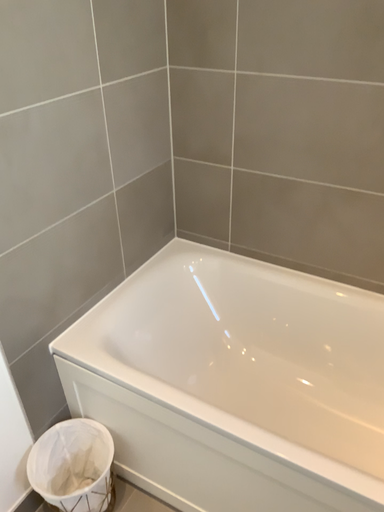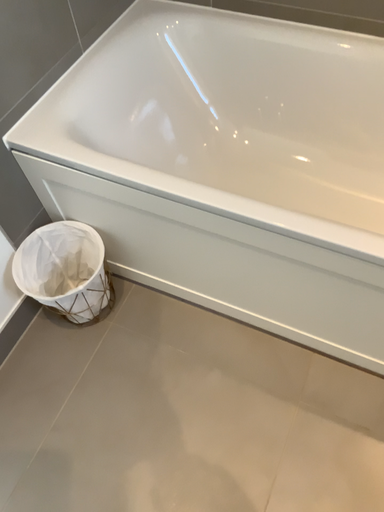
Question: How did the camera likely rotate when shooting the video?

Choices:
 (A) rotated downward
 (B) rotated upward

Answer: (A)